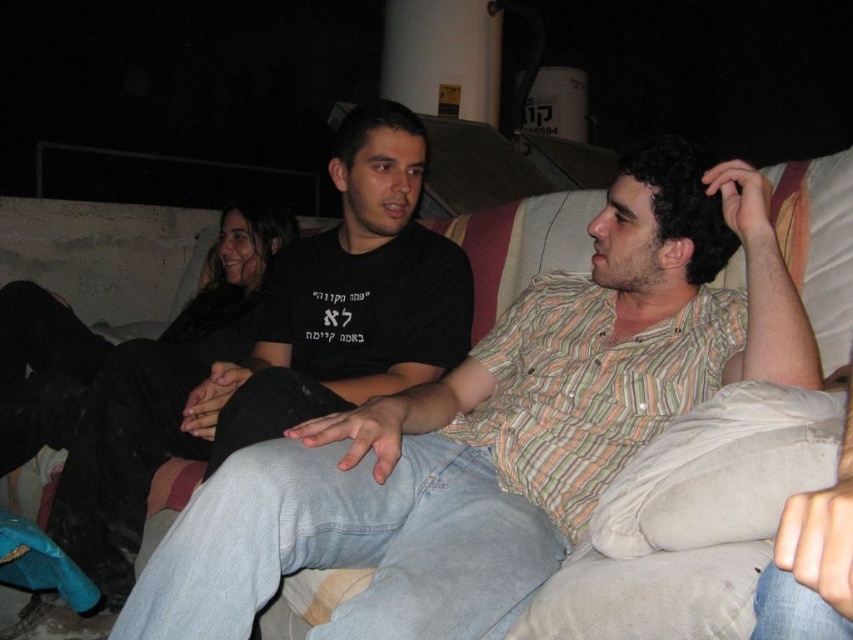
Does striped cotton shirt at center appear over black cotton shirt at center?

Actually, striped cotton shirt at center is below black cotton shirt at center.

Measure the distance between striped cotton shirt at center and black cotton shirt at center.

striped cotton shirt at center and black cotton shirt at center are 45.91 centimeters apart from each other.

Measure the distance between striped cotton shirt at center and camera.

A distance of 28.97 inches exists between striped cotton shirt at center and camera.

The image size is (853, 640). I want to click on striped cotton shirt at center, so click(x=495, y=429).